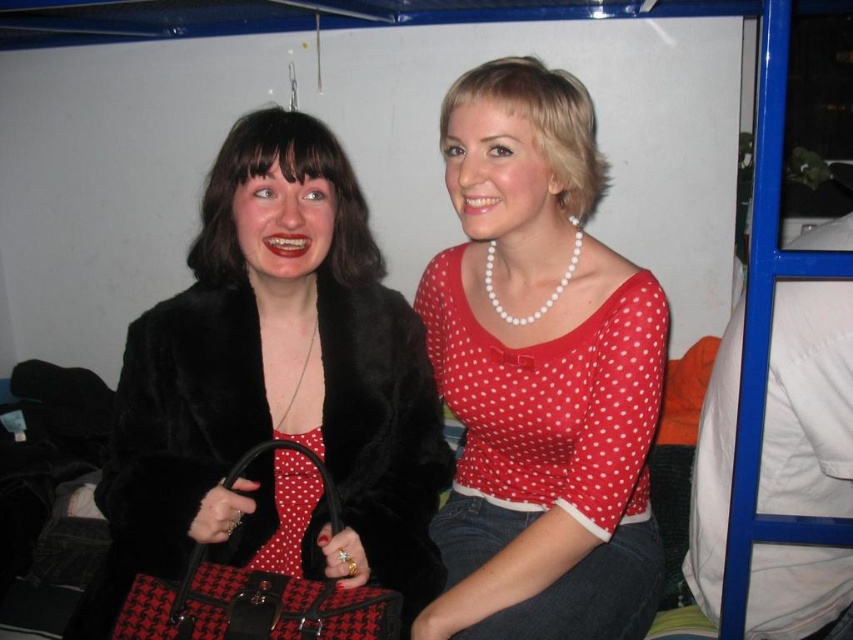
Question: Is matte black fur coat at left bigger than houndstooth fabric handbag at center?

Choices:
 (A) no
 (B) yes

Answer: (B)

Question: Considering the real-world distances, which object is farthest from the houndstooth fabric handbag at center?

Choices:
 (A) matte black fur coat at left
 (B) pearl necklace at upper center

Answer: (B)

Question: Which object is the closest to the matte black fur coat at left?

Choices:
 (A) pearl necklace at upper center
 (B) houndstooth fabric handbag at center

Answer: (B)

Question: Can you confirm if pearl necklace at upper center is positioned to the left of houndstooth fabric handbag at center?

Choices:
 (A) no
 (B) yes

Answer: (A)

Question: Observing the image, what is the correct spatial positioning of matte black fur coat at left in reference to pearl necklace at upper center?

Choices:
 (A) below
 (B) above

Answer: (A)

Question: Which of the following is the closest to the observer?

Choices:
 (A) pearl necklace at upper center
 (B) houndstooth fabric handbag at center
 (C) matte black fur coat at left

Answer: (B)